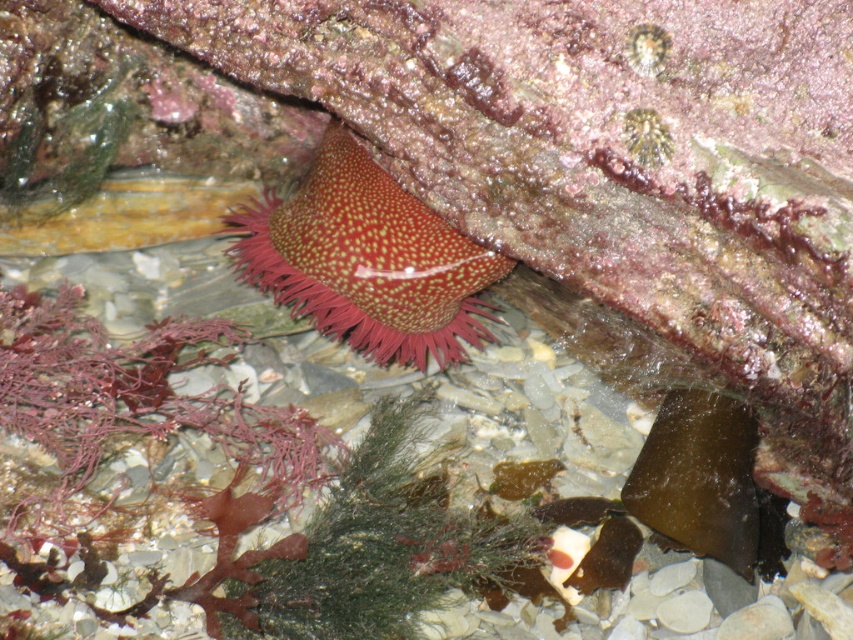
Question: Which of the following is the farthest from the observer?

Choices:
 (A) shiny red anemone at center
 (B) green matte algae at center

Answer: (A)

Question: Can you confirm if shiny red anemone at center is positioned to the left of green matte algae at center?

Choices:
 (A) no
 (B) yes

Answer: (B)

Question: Does shiny red anemone at center appear over green matte algae at center?

Choices:
 (A) no
 (B) yes

Answer: (B)

Question: Is shiny red anemone at center to the right of green matte algae at center from the viewer's perspective?

Choices:
 (A) no
 (B) yes

Answer: (A)